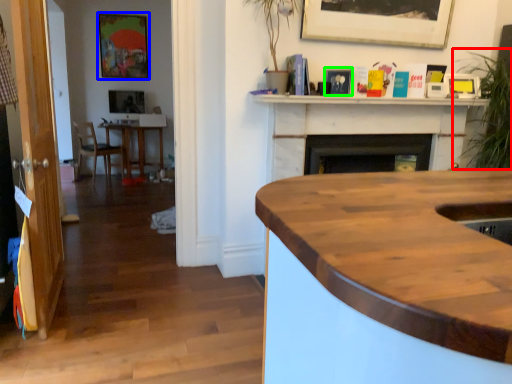
Question: Which object is positioned farthest from plant (highlighted by a red box)? Select from picture frame (highlighted by a blue box) and picture frame (highlighted by a green box).

Choices:
 (A) picture frame
 (B) picture frame

Answer: (A)